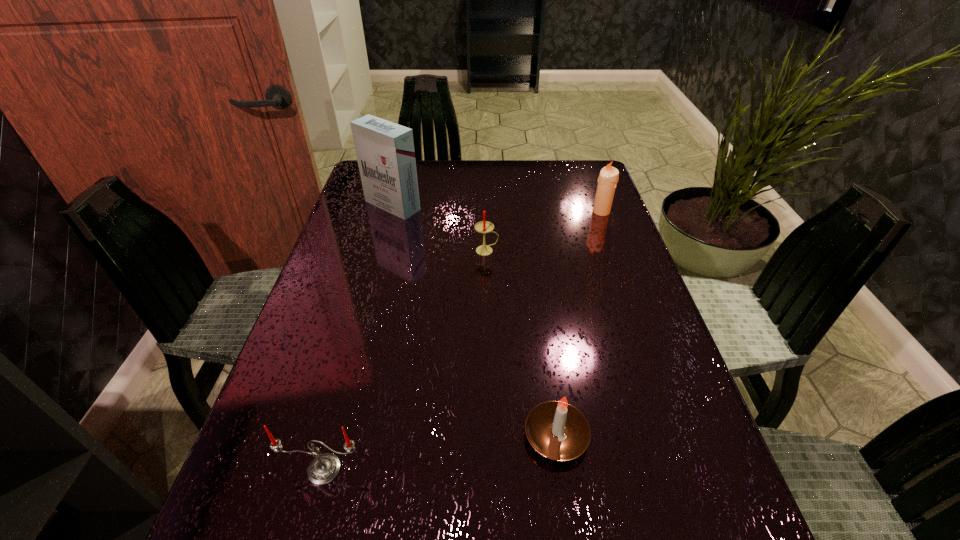
Identify which object is the nearest to the second farthest candle. Please provide its 2D coordinates. Your answer should be formatted as a tuple, i.e. [(x, y)], where the tuple contains the x and y coordinates of a point satisfying the conditions above.

[(385, 152)]

I want to click on object identified as the second closest to the second candle from left to right, so click(608, 178).

Select which candle is the second closest to the tallest object. Please provide its 2D coordinates. Your answer should be formatted as a tuple, i.e. [(x, y)], where the tuple contains the x and y coordinates of a point satisfying the conditions above.

[(608, 178)]

Point out which candle is positioned as the second nearest to the second object from right to left. Please provide its 2D coordinates. Your answer should be formatted as a tuple, i.e. [(x, y)], where the tuple contains the x and y coordinates of a point satisfying the conditions above.

[(484, 226)]

Find the location of a particular element. free point that satisfies the following two spatial constraints: 1. on the back side of the tallest candle; 2. on the left side of the fourth object from left to right is located at coordinates (526, 212).

Where is `free spot that satisfies the following two spatial constraints: 1. on the front side of the cigarette case; 2. on the right side of the farthest candle`? The height and width of the screenshot is (540, 960). free spot that satisfies the following two spatial constraints: 1. on the front side of the cigarette case; 2. on the right side of the farthest candle is located at coordinates (391, 212).